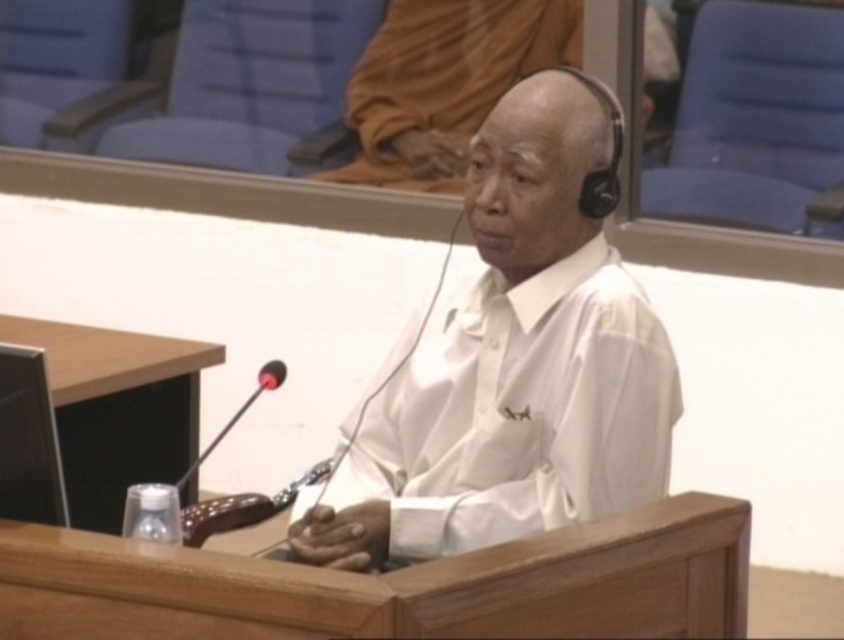
You are an observer in the courtroom. You see the white matte shirt at center and the black plastic microphone at lower center. Which object is closer to you?

The white matte shirt at center is closer to you because it is positioned further to the viewer than the black plastic microphone at lower center.

You are an observer in the courtroom scene. You notice the white matte shirt at center and the black plastic microphone at lower center. Which object is positioned higher in the image?

The white matte shirt at center is located above the black plastic microphone at lower center, so it is positioned higher in the image.